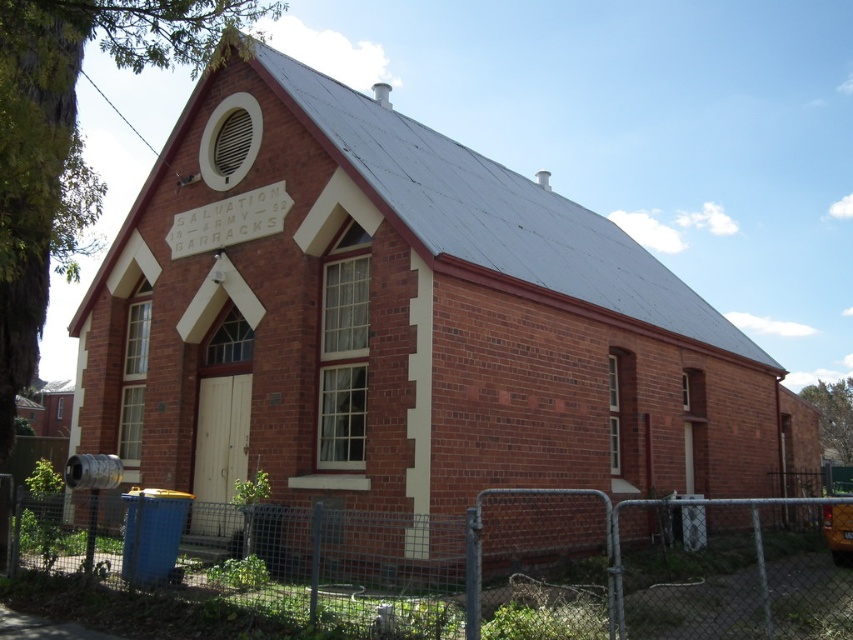
Does metal chain-link fence at lower center appear over yellow matte school bus at lower right?

Yes, metal chain-link fence at lower center is above yellow matte school bus at lower right.

Is metal chain-link fence at lower center wider than yellow matte school bus at lower right?

Indeed, metal chain-link fence at lower center has a greater width compared to yellow matte school bus at lower right.

What are the coordinates of `metal chain-link fence at lower center` in the screenshot? It's located at (471, 564).